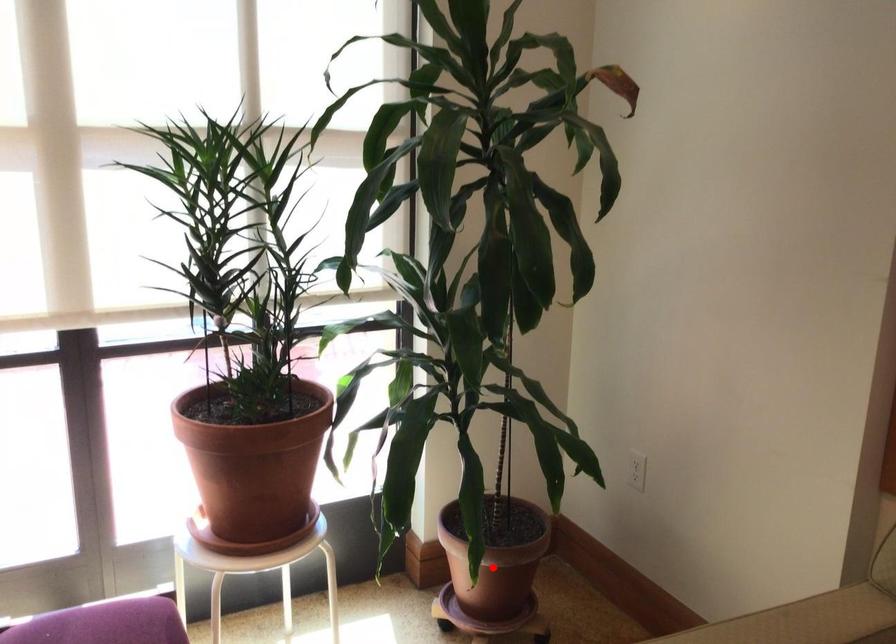
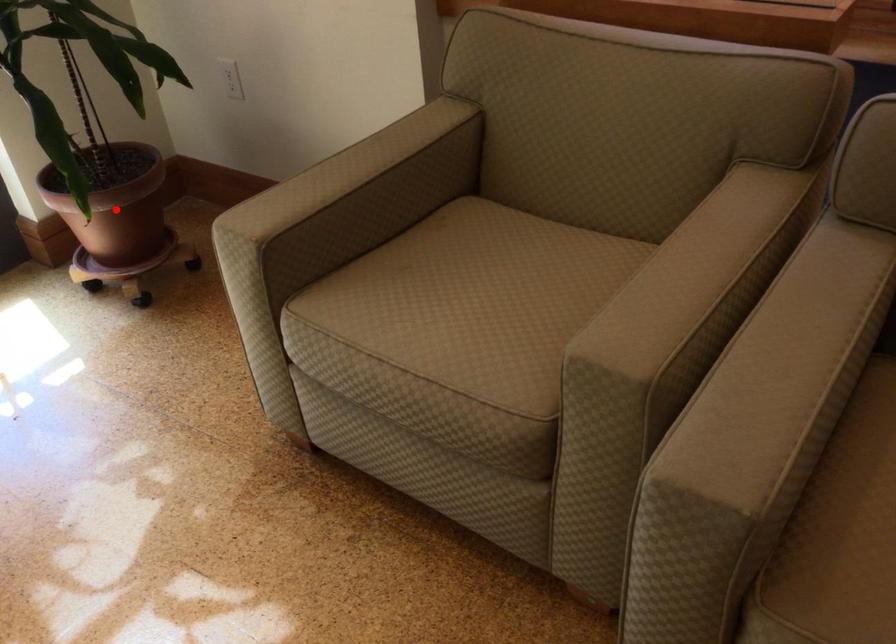
I am providing you with two images of the same scene from different viewpoints. A red point is marked on the first image and another point is marked on the second image. Is the red point in image1 aligned with the point shown in image2?

Yes